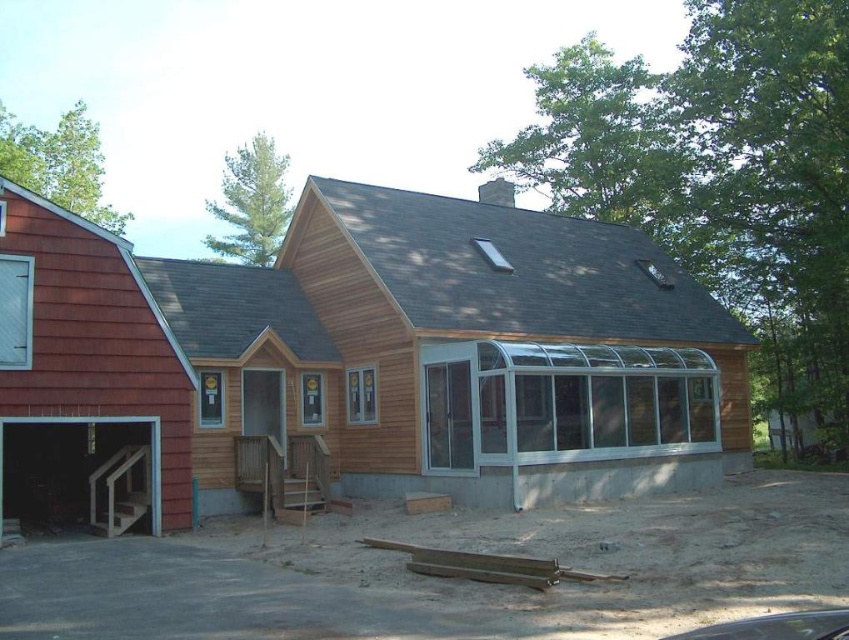
Question: Which point appears closest to the camera in this image?

Choices:
 (A) (21, 419)
 (B) (155, 364)

Answer: (A)

Question: Is wooden barn at center smaller than matte wood stairs at lower left?

Choices:
 (A) no
 (B) yes

Answer: (A)

Question: Does wooden barn at center have a greater width compared to matte wood stairs at lower left?

Choices:
 (A) yes
 (B) no

Answer: (A)

Question: Which of the following is the farthest from the observer?

Choices:
 (A) (99, 420)
 (B) (692, 278)

Answer: (B)

Question: Which of the following is the farthest from the observer?

Choices:
 (A) wooden barn at center
 (B) matte wood stairs at lower left

Answer: (B)

Question: In this image, where is wooden barn at center located relative to matte wood stairs at lower left?

Choices:
 (A) above
 (B) below

Answer: (A)